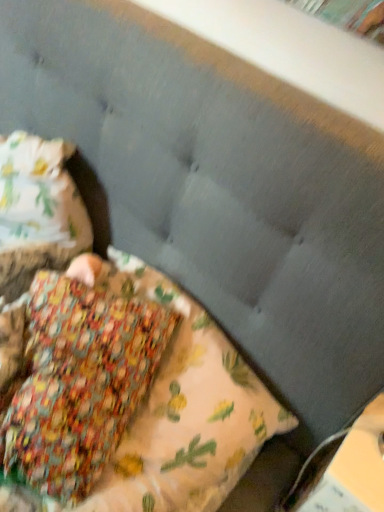
Question: Should I look upward or downward to see hardcover book at lower right?

Choices:
 (A) up
 (B) down

Answer: (B)

Question: Is hardcover book at lower right further to the viewer compared to floral fabric pillow at center?

Choices:
 (A) no
 (B) yes

Answer: (B)

Question: Is hardcover book at lower right next to floral fabric pillow at center and touching it?

Choices:
 (A) yes
 (B) no

Answer: (B)

Question: Does hardcover book at lower right lie in front of floral fabric pillow at center?

Choices:
 (A) no
 (B) yes

Answer: (A)

Question: Can you confirm if hardcover book at lower right is shorter than floral fabric pillow at center?

Choices:
 (A) yes
 (B) no

Answer: (B)

Question: From a real-world perspective, is hardcover book at lower right below floral fabric pillow at center?

Choices:
 (A) no
 (B) yes

Answer: (B)

Question: From the image's perspective, is hardcover book at lower right on floral fabric pillow at center?

Choices:
 (A) no
 (B) yes

Answer: (A)

Question: From a real-world perspective, is floral fabric pillow at center under hardcover book at lower right?

Choices:
 (A) no
 (B) yes

Answer: (A)

Question: From the image's perspective, does floral fabric pillow at center appear lower than hardcover book at lower right?

Choices:
 (A) yes
 (B) no

Answer: (B)

Question: Is floral fabric pillow at center wider than hardcover book at lower right?

Choices:
 (A) yes
 (B) no

Answer: (A)

Question: Is floral fabric pillow at center positioned behind hardcover book at lower right?

Choices:
 (A) yes
 (B) no

Answer: (B)

Question: Is hardcover book at lower right completely or partially inside floral fabric pillow at center?

Choices:
 (A) yes
 (B) no

Answer: (B)

Question: Considering the relative sizes of floral fabric pillow at center and hardcover book at lower right in the image provided, is floral fabric pillow at center smaller than hardcover book at lower right?

Choices:
 (A) yes
 (B) no

Answer: (B)

Question: Looking at their shapes, would you say hardcover book at lower right is wider or thinner than floral fabric pillow at center?

Choices:
 (A) wide
 (B) thin

Answer: (B)